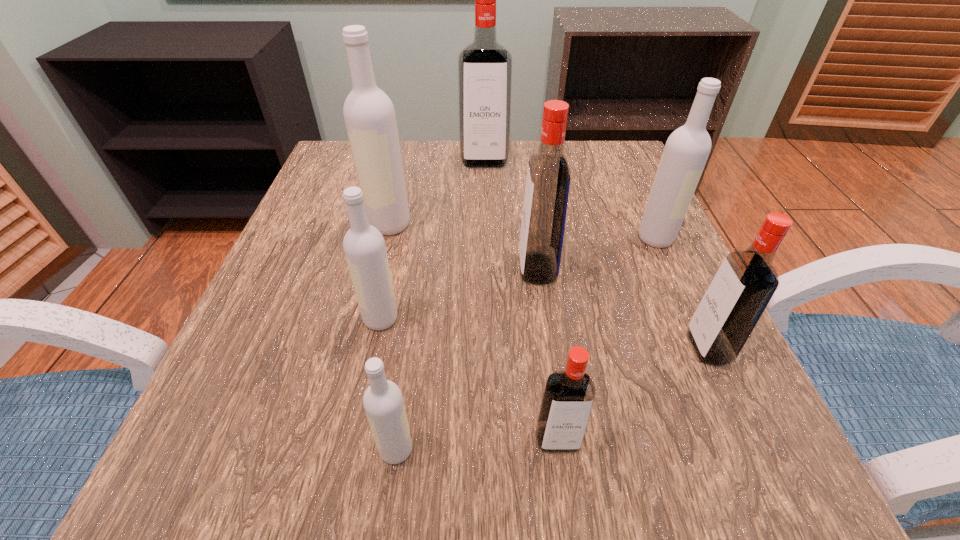
Image resolution: width=960 pixels, height=540 pixels. I want to click on the second white vodka from right to left, so click(383, 402).

Locate an element on the screen. the smallest white vodka is located at coordinates click(383, 402).

Find the location of a particular element. This screenshot has width=960, height=540. free space located 0.240m on the front and back of the biggest red vodka is located at coordinates [x=486, y=234].

Locate an element on the screen. The image size is (960, 540). vacant region located on the front of the biggest white vodka is located at coordinates (341, 426).

Find the location of a particular element. The width and height of the screenshot is (960, 540). free region located on the front of the rightmost white vodka is located at coordinates (737, 416).

This screenshot has width=960, height=540. Identify the location of vacant space located on the front and back of the fifth nearest vodka. pos(480,269).

This screenshot has width=960, height=540. What are the coordinates of `free space located 0.200m on the front and back of the fifth nearest vodka` in the screenshot? It's located at (408, 269).

You are a GUI agent. You are given a task and a screenshot of the screen. Output one action in this format:
    pyautogui.click(x=<x>, y=<y>)
    Task: Click on the free space located 0.400m on the front and back of the fifth nearest vodka
    The image size is (960, 540).
    Given the screenshot: What is the action you would take?
    pyautogui.click(x=297, y=269)

This screenshot has width=960, height=540. I want to click on vacant region located 0.320m on the back of the second nearest white vodka, so click(x=407, y=197).

Find the location of a particular element. vacant region located on the front and back of the second nearest red vodka is located at coordinates (452, 347).